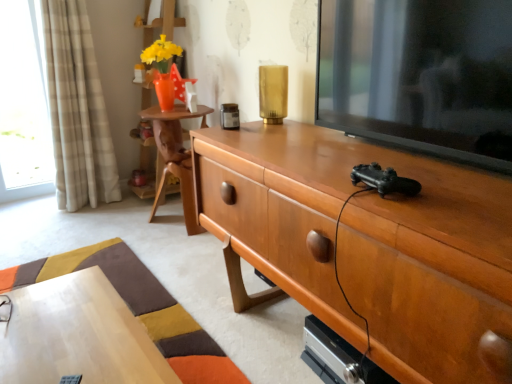
Question: Does clear glass window at left come in front of woodenmaterial/texturebookshelf at upper left?

Choices:
 (A) no
 (B) yes

Answer: (A)

Question: Considering the relative sizes of clear glass window at left and woodenmaterial/texturebookshelf at upper left in the image provided, is clear glass window at left smaller than woodenmaterial/texturebookshelf at upper left?

Choices:
 (A) yes
 (B) no

Answer: (A)

Question: Can you confirm if clear glass window at left is thinner than woodenmaterial/texturebookshelf at upper left?

Choices:
 (A) yes
 (B) no

Answer: (A)

Question: Would you say woodenmaterial/texturebookshelf at upper left is part of clear glass window at left's contents?

Choices:
 (A) no
 (B) yes

Answer: (A)

Question: Is clear glass window at left looking in the opposite direction of woodenmaterial/texturebookshelf at upper left?

Choices:
 (A) no
 (B) yes

Answer: (A)

Question: In the image, is beige plaid curtain at left on the left side or the right side of black glossy television at right?

Choices:
 (A) right
 (B) left

Answer: (B)

Question: Looking at their shapes, would you say beige plaid curtain at left is wider or thinner than black glossy television at right?

Choices:
 (A) wide
 (B) thin

Answer: (A)

Question: Based on their sizes in the image, would you say beige plaid curtain at left is bigger or smaller than black glossy television at right?

Choices:
 (A) small
 (B) big

Answer: (B)

Question: Choose the correct answer: Is beige plaid curtain at left inside black glossy television at right or outside it?

Choices:
 (A) inside
 (B) outside

Answer: (B)

Question: Is wooden desk at lower left wider or thinner than beige plaid curtain at left?

Choices:
 (A) thin
 (B) wide

Answer: (B)

Question: From their relative heights in the image, would you say wooden desk at lower left is taller or shorter than beige plaid curtain at left?

Choices:
 (A) short
 (B) tall

Answer: (A)

Question: Does point (40, 359) appear closer or farther from the camera than point (93, 170)?

Choices:
 (A) closer
 (B) farther

Answer: (A)

Question: Which is correct: wooden desk at lower left is inside beige plaid curtain at left, or outside of it?

Choices:
 (A) inside
 (B) outside

Answer: (B)

Question: Considering the positions of woodenmaterial/texturebookshelf at upper left and beige plaid curtain at left in the image, is woodenmaterial/texturebookshelf at upper left bigger or smaller than beige plaid curtain at left?

Choices:
 (A) small
 (B) big

Answer: (B)

Question: From a real-world perspective, is woodenmaterial/texturebookshelf at upper left above or below beige plaid curtain at left?

Choices:
 (A) below
 (B) above

Answer: (B)